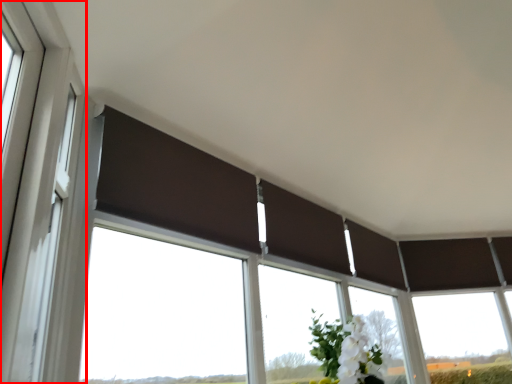
Question: Considering the relative positions of window frame (annotated by the red box) and window in the image provided, where is window frame (annotated by the red box) located with respect to the staircase?

Choices:
 (A) left
 (B) right

Answer: (A)